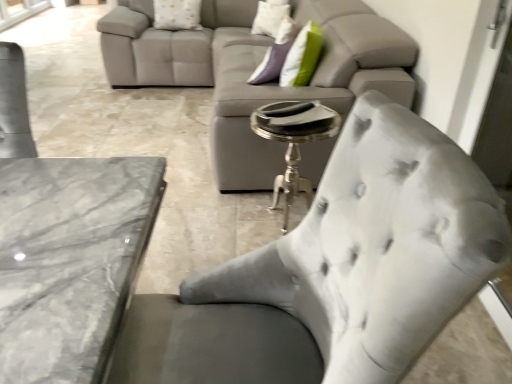
Question: Is satin gray chair at lower right to the right of white textured pillow at upper center, the second pillow when ordered from left to right, from the viewer's perspective?

Choices:
 (A) no
 (B) yes

Answer: (A)

Question: Can you confirm if satin gray chair at lower right is shorter than white textured pillow at upper center, arranged as the 1th pillow when viewed from the right?

Choices:
 (A) no
 (B) yes

Answer: (B)

Question: Considering the relative sizes of satin gray chair at lower right and white textured pillow at upper center, arranged as the 1th pillow when viewed from the right, in the image provided, is satin gray chair at lower right wider than white textured pillow at upper center, arranged as the 1th pillow when viewed from the right,?

Choices:
 (A) no
 (B) yes

Answer: (B)

Question: From a real-world perspective, is satin gray chair at lower right on white textured pillow at upper center, arranged as the 1th pillow when viewed from the right?

Choices:
 (A) no
 (B) yes

Answer: (A)

Question: From a real-world perspective, is satin gray chair at lower right physically below white textured pillow at upper center, arranged as the 1th pillow when viewed from the right?

Choices:
 (A) no
 (B) yes

Answer: (B)

Question: Would you say satin gray chair at lower right is inside or outside silver metallic side table at center?

Choices:
 (A) inside
 (B) outside

Answer: (B)

Question: Visually, is satin gray chair at lower right positioned to the left or to the right of silver metallic side table at center?

Choices:
 (A) right
 (B) left

Answer: (B)

Question: From a real-world perspective, relative to silver metallic side table at center, is satin gray chair at lower right vertically above or below?

Choices:
 (A) below
 (B) above

Answer: (A)

Question: Is satin gray chair at lower right taller or shorter than silver metallic side table at center?

Choices:
 (A) short
 (B) tall

Answer: (A)

Question: Considering the positions of white textured pillow at upper center, the first pillow from the left, and silver metallic side table at center in the image, is white textured pillow at upper center, the first pillow from the left, bigger or smaller than silver metallic side table at center?

Choices:
 (A) big
 (B) small

Answer: (B)

Question: From their relative heights in the image, would you say white textured pillow at upper center, the 2th pillow in the right-to-left sequence, is taller or shorter than silver metallic side table at center?

Choices:
 (A) tall
 (B) short

Answer: (B)

Question: Looking at their shapes, would you say white textured pillow at upper center, the 2th pillow in the right-to-left sequence, is wider or thinner than silver metallic side table at center?

Choices:
 (A) wide
 (B) thin

Answer: (B)

Question: Is white textured pillow at upper center, the first pillow from the left, to the left or to the right of silver metallic side table at center in the image?

Choices:
 (A) right
 (B) left

Answer: (B)

Question: Looking at the image, does satin gray chair at lower right seem bigger or smaller compared to white textured pillow at upper center, arranged as the 1th pillow when viewed from the right?

Choices:
 (A) big
 (B) small

Answer: (A)

Question: From a real-world perspective, is satin gray chair at lower right above or below white textured pillow at upper center, arranged as the 1th pillow when viewed from the right?

Choices:
 (A) above
 (B) below

Answer: (B)